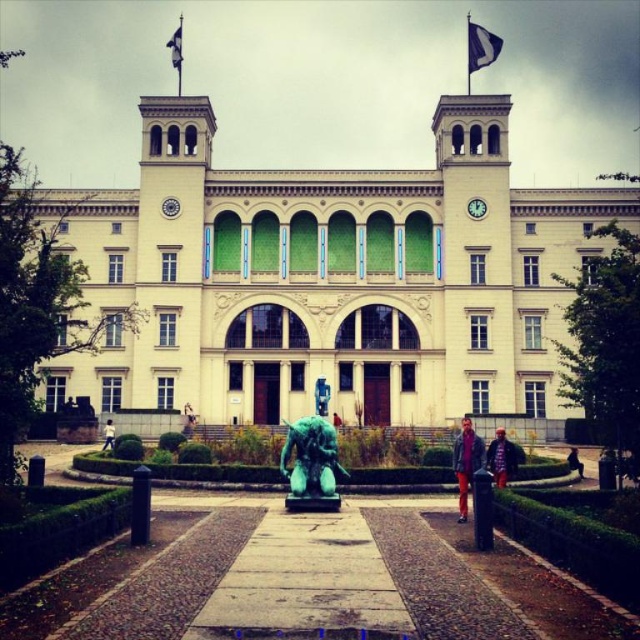
Between white stone building at center and matte purple jacket at center, which one has less height?

matte purple jacket at center is shorter.

Does white stone building at center appear on the left side of matte purple jacket at center?

Yes, white stone building at center is to the left of matte purple jacket at center.

Where is `white stone building at center`? The image size is (640, 640). white stone building at center is located at coordinates (326, 278).

Locate an element on the screen. The width and height of the screenshot is (640, 640). white stone building at center is located at coordinates (326, 278).

Between green metallic statue at center and white matte statue at center, which one is positioned lower?

white matte statue at center

Between green metallic statue at center and white matte statue at center, which one has less height?

Standing shorter between the two is white matte statue at center.

The width and height of the screenshot is (640, 640). What are the coordinates of `green metallic statue at center` in the screenshot? It's located at (500, 458).

Which of these two, green patinated bronze statue at center or green metallic statue at center, stands shorter?

green metallic statue at center

Measure the distance between green patinated bronze statue at center and camera.

The distance of green patinated bronze statue at center from camera is 70.10 meters.

What are the coordinates of `green patinated bronze statue at center` in the screenshot? It's located at (310, 465).